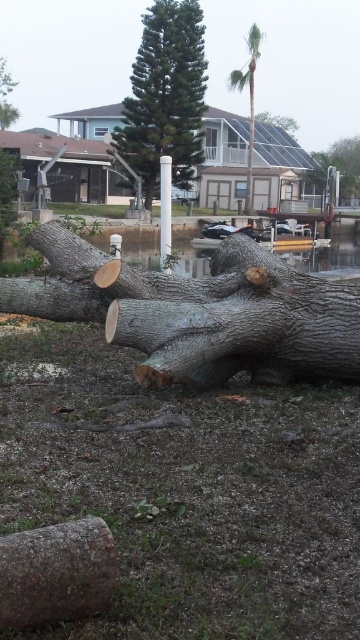
Between brown rough log at lower left and white plastic pole at center, which one is positioned higher?

white plastic pole at center

Does point (0, 602) come closer to viewer compared to point (165, 230)?

Yes, it is.

Does point (65, 579) come closer to viewer compared to point (160, 193)?

Yes.

Locate an element on the screen. This screenshot has width=360, height=640. brown rough log at lower left is located at coordinates (56, 572).

Is point (358, 147) farther from viewer compared to point (243, 74)?

Yes, it is.

You are a GUI agent. You are given a task and a screenshot of the screen. Output one action in this format:
    pyautogui.click(x=<x>, y=<y>)
    Task: Click on the smooth gray log at center
    
    Given the screenshot: What is the action you would take?
    pyautogui.click(x=338, y=166)

Does green textured pine tree at upper center have a smaller size compared to green rough bark tree at center?

No, green textured pine tree at upper center is not smaller than green rough bark tree at center.

Does green textured pine tree at upper center have a greater height compared to green rough bark tree at center?

Indeed, green textured pine tree at upper center has a greater height compared to green rough bark tree at center.

This screenshot has height=640, width=360. Find the location of `green textured pine tree at upper center`. green textured pine tree at upper center is located at coordinates (165, 96).